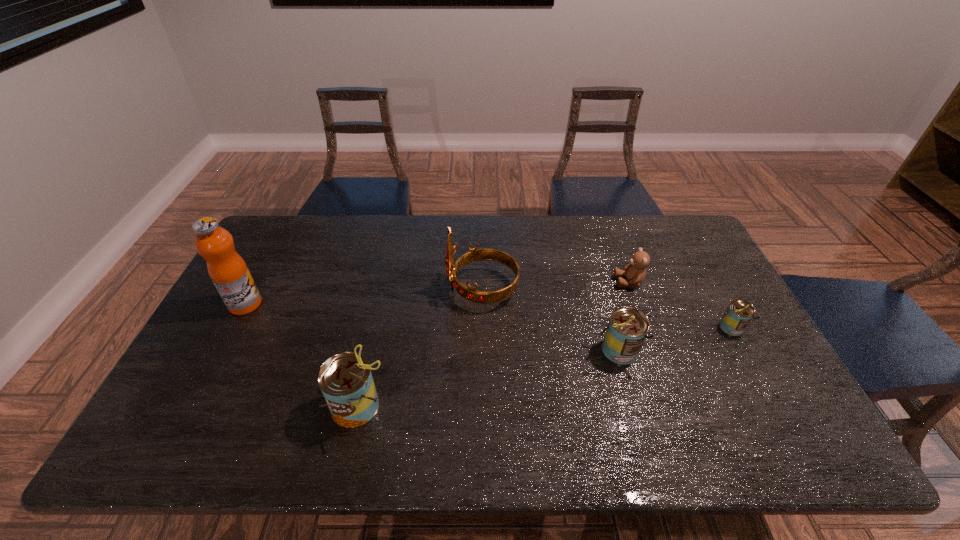
I want to click on free space between the nearest can and the tiara, so click(420, 347).

Image resolution: width=960 pixels, height=540 pixels. I want to click on free space between the tiara and the teddy bear, so click(556, 286).

Find the location of a particular element. empty space between the teddy bear and the fourth object from right to left is located at coordinates (556, 286).

This screenshot has width=960, height=540. I want to click on free point between the shortest can and the fourth object from right to left, so click(607, 308).

The image size is (960, 540). Find the location of `free space between the shortest can and the tiara`. free space between the shortest can and the tiara is located at coordinates (607, 308).

Locate an element on the screen. The image size is (960, 540). empty space between the tiara and the shortest can is located at coordinates (607, 308).

Locate which object ranks fifth in proximity to the nearest can. Please provide its 2D coordinates. Your answer should be formatted as a tuple, i.e. [(x, y)], where the tuple contains the x and y coordinates of a point satisfying the conditions above.

[(738, 314)]

Locate an element on the screen. This screenshot has height=540, width=960. object that is the fourth nearest to the shortest can is located at coordinates (345, 379).

Identify the location of can identified as the second closest to the teddy bear. This screenshot has width=960, height=540. 738,314.

Identify which can is the closest to the teddy bear. Please provide its 2D coordinates. Your answer should be formatted as a tuple, i.e. [(x, y)], where the tuple contains the x and y coordinates of a point satisfying the conditions above.

[(627, 329)]